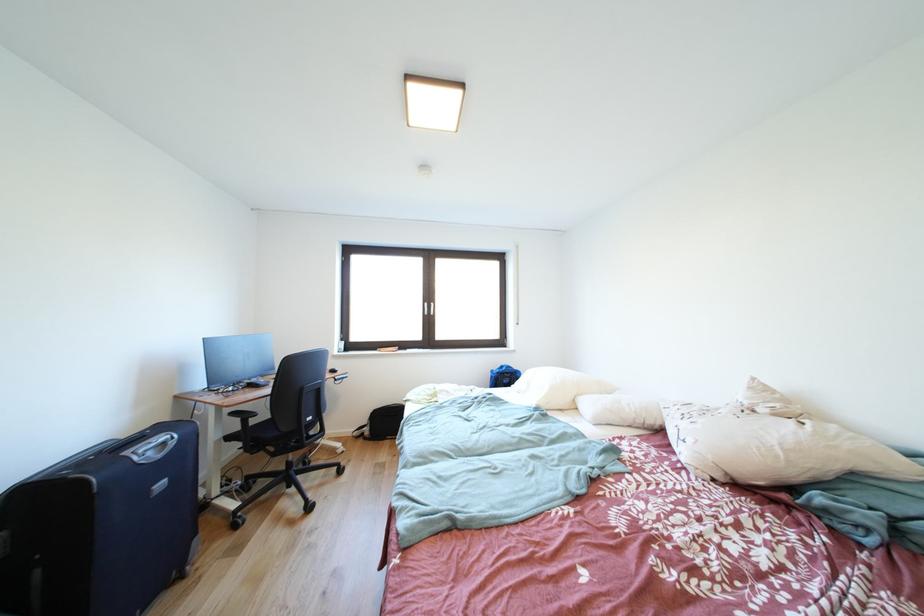
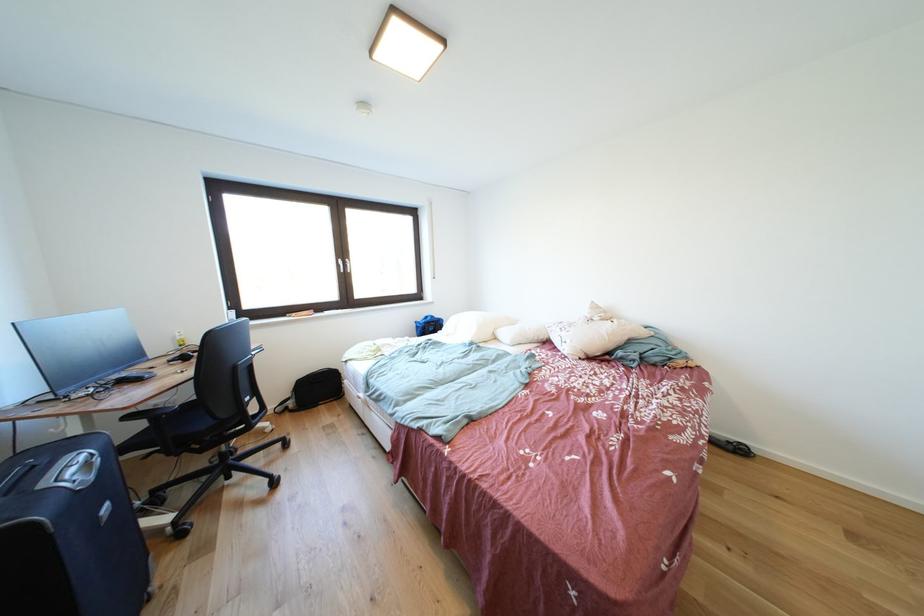
Locate, in the second image, the point that corresponds to the point at 167,461 in the first image.

(101, 483)